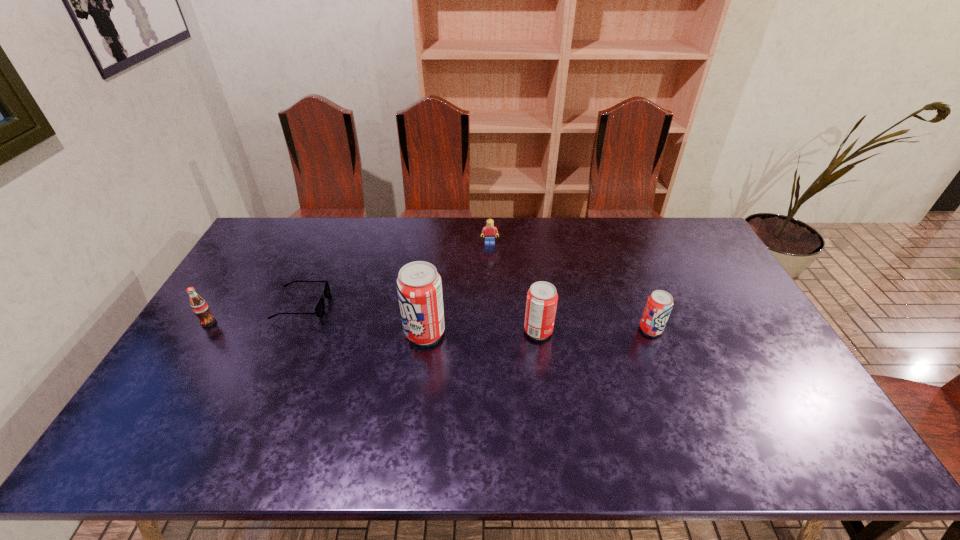
I want to click on free point that keeps the soda cans evenly spaced on the right, so click(762, 328).